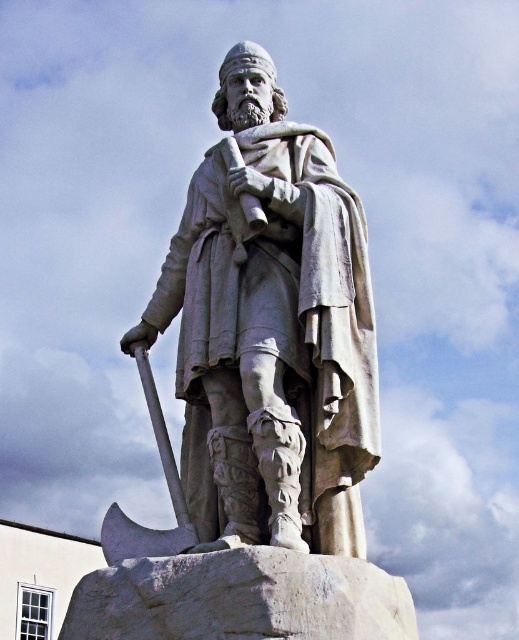
You are a tour guide explaining the statue to visitors. You want to mention the position of the polished silver axe at lower left relative to the white stone statue at center. How would you describe its placement?

The polished silver axe at lower left is positioned below the white stone statue at center.